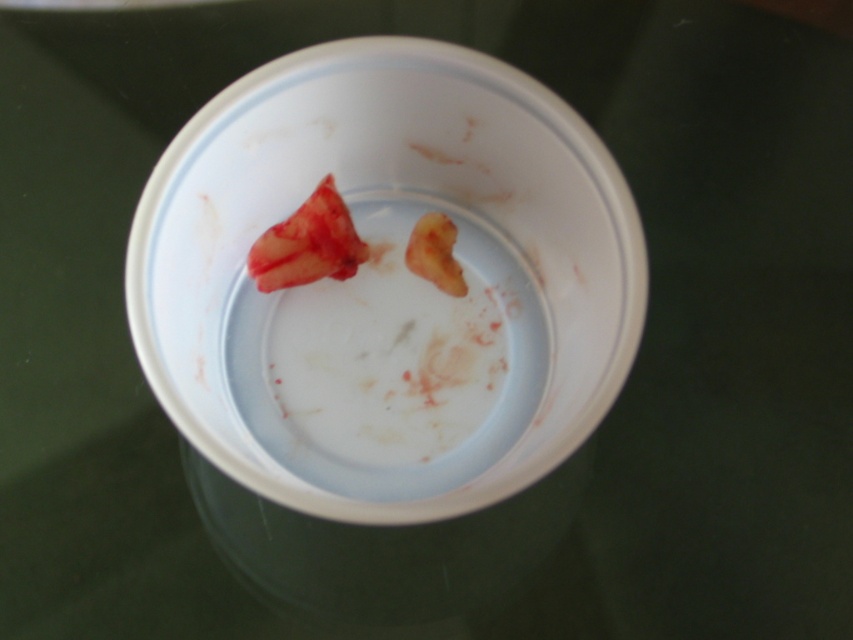
Question: Is the position of white glossy plate at center less distant than that of yellowish matte flesh at center?

Choices:
 (A) yes
 (B) no

Answer: (A)

Question: Which of these objects is positioned closest to the meaty red at center?

Choices:
 (A) white glossy plate at center
 (B) yellowish matte flesh at center

Answer: (B)

Question: Which of the following is the farthest from the observer?

Choices:
 (A) (409, 236)
 (B) (160, 234)

Answer: (A)

Question: Can you confirm if meaty red at center is bigger than yellowish matte flesh at center?

Choices:
 (A) no
 (B) yes

Answer: (B)

Question: Which point is closer to the camera?

Choices:
 (A) (453, 280)
 (B) (343, 257)
 (C) (548, 346)

Answer: (B)

Question: Can you confirm if white glossy plate at center is bigger than meaty red at center?

Choices:
 (A) no
 (B) yes

Answer: (B)